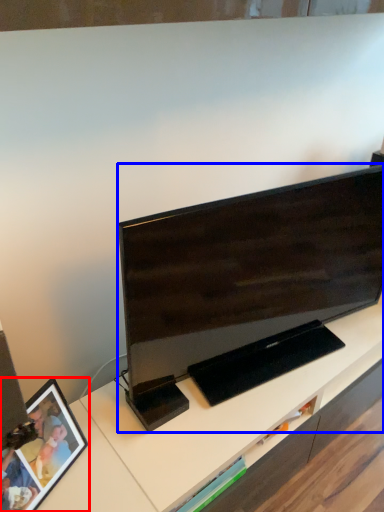
Question: Which object appears closest to the camera in this image, picture frame (highlighted by a red box) or television (highlighted by a blue box)?

Choices:
 (A) picture frame
 (B) television

Answer: (A)